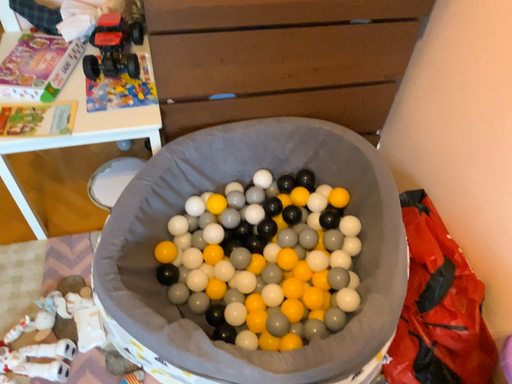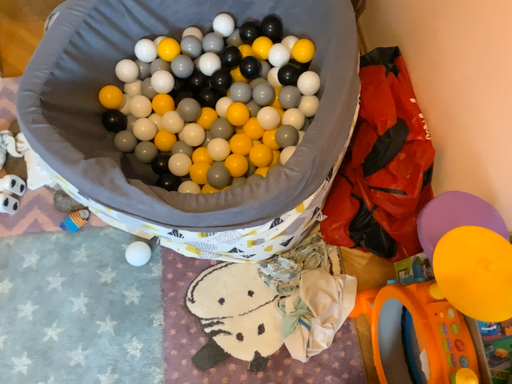
Question: Which way did the camera rotate in the video?

Choices:
 (A) rotated upward
 (B) rotated downward

Answer: (B)